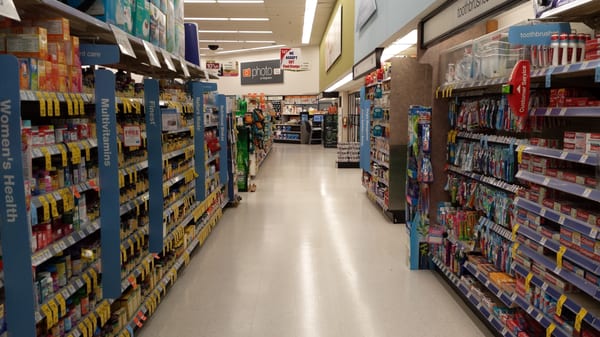
Locate an element on the screen. overhead flourescent lights is located at coordinates (206, 19), (247, 18), (304, 19), (250, 31), (214, 29), (230, 40), (254, 33), (226, 0).